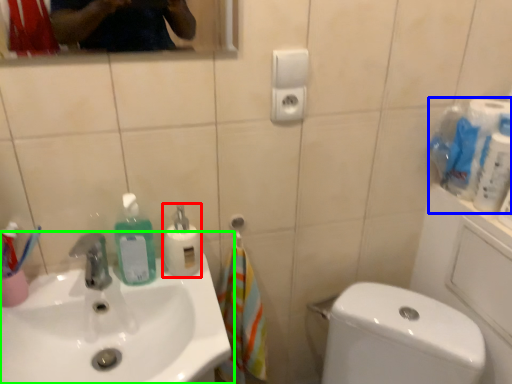
Question: Which object is positioned farthest from cleaning product (highlighted by a red box)? Select from toilet paper (highlighted by a blue box) and sink (highlighted by a green box).

Choices:
 (A) toilet paper
 (B) sink

Answer: (A)